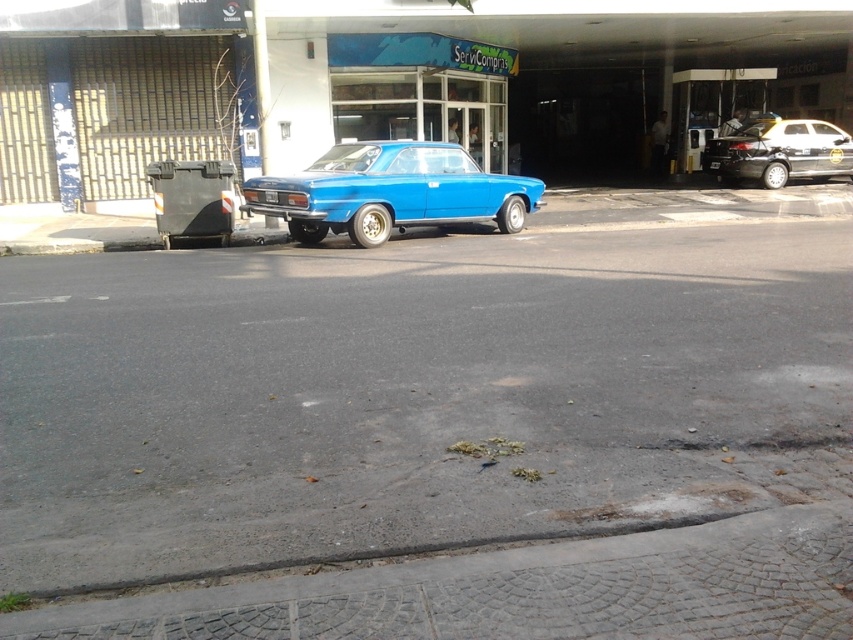
Question: Is gray concrete curb at lower center smaller than blue glossy license plate at center?

Choices:
 (A) no
 (B) yes

Answer: (A)

Question: Which is nearer to the gray concrete curb at lower center?

Choices:
 (A) matte blue car at center
 (B) blue glossy license plate at center
 (C) shiny black sedan at right

Answer: (A)

Question: Among these points, which one is farthest from the camera?

Choices:
 (A) (778, 518)
 (B) (270, 196)
 (C) (711, 170)
 (D) (381, 147)

Answer: (C)

Question: Is gray concrete curb at lower center smaller than blue glossy license plate at center?

Choices:
 (A) no
 (B) yes

Answer: (A)

Question: Considering the real-world distances, which object is closest to the gray concrete curb at lower center?

Choices:
 (A) blue glossy license plate at center
 (B) matte blue car at center
 (C) shiny black sedan at right

Answer: (B)

Question: Observing the image, what is the correct spatial positioning of matte blue car at center in reference to blue glossy license plate at center?

Choices:
 (A) above
 (B) below

Answer: (A)